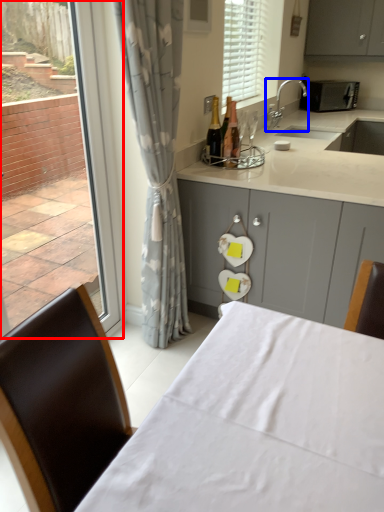
Question: Which object is further to the camera taking this photo, window (highlighted by a red box) or tap (highlighted by a blue box)?

Choices:
 (A) window
 (B) tap

Answer: (B)